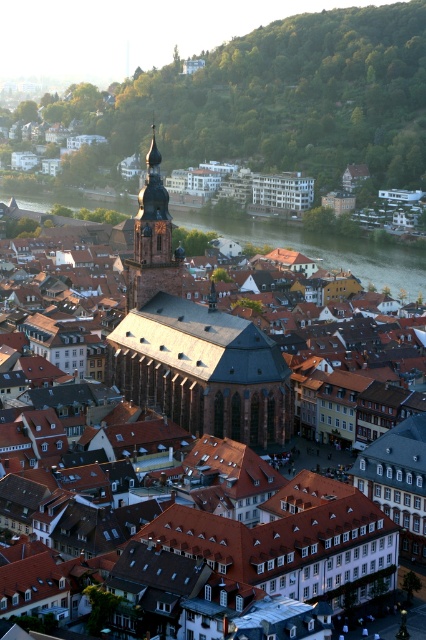
You are a tourist standing in the town square and want to take a photo of the smooth copper spire at center and the green water at center. How far apart are these two landmarks in the image?

The green water at center and smooth copper spire at center are 143.08 meters apart.

You are standing in the historic European town and want to take a photo. You notice two points marked in the scene. Which point is closer to your camera, point 1 at coordinates point (271, 227) or point 2 at coordinates point (172, 280)?

Point 2 at coordinates point (172, 280) is closer to the camera because it is less further than point 1 at coordinates point (271, 227).